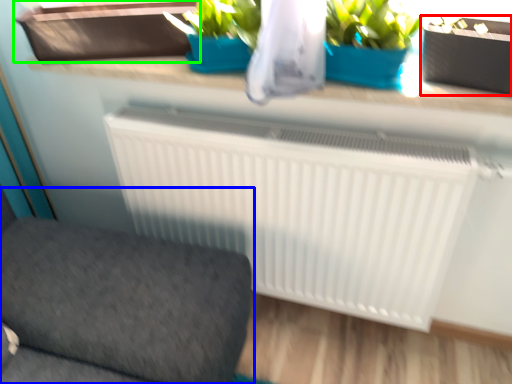
Question: Based on their relative distances, which object is farther from flowerpot (highlighted by a red box)? Choose from furniture (highlighted by a blue box) and window box (highlighted by a green box).

Choices:
 (A) furniture
 (B) window box

Answer: (A)